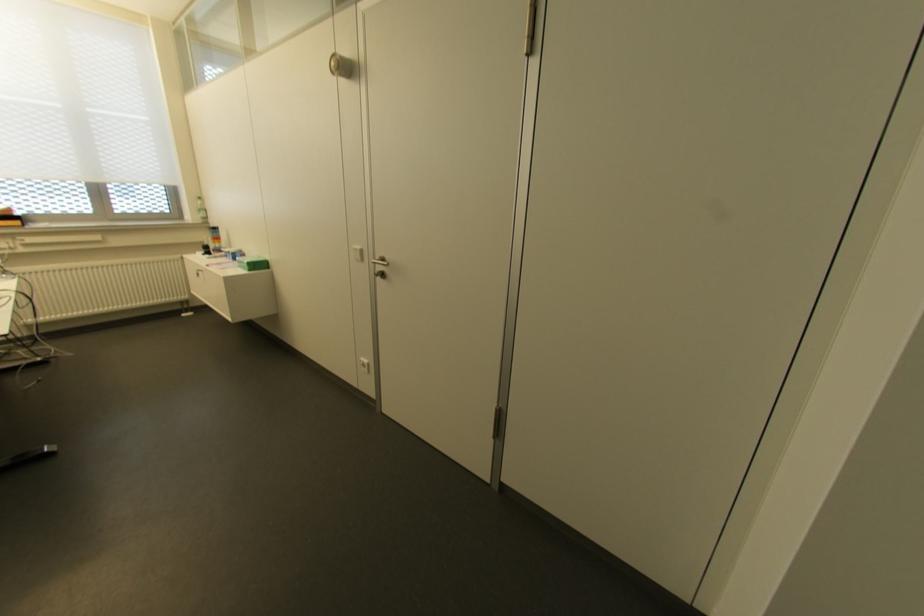
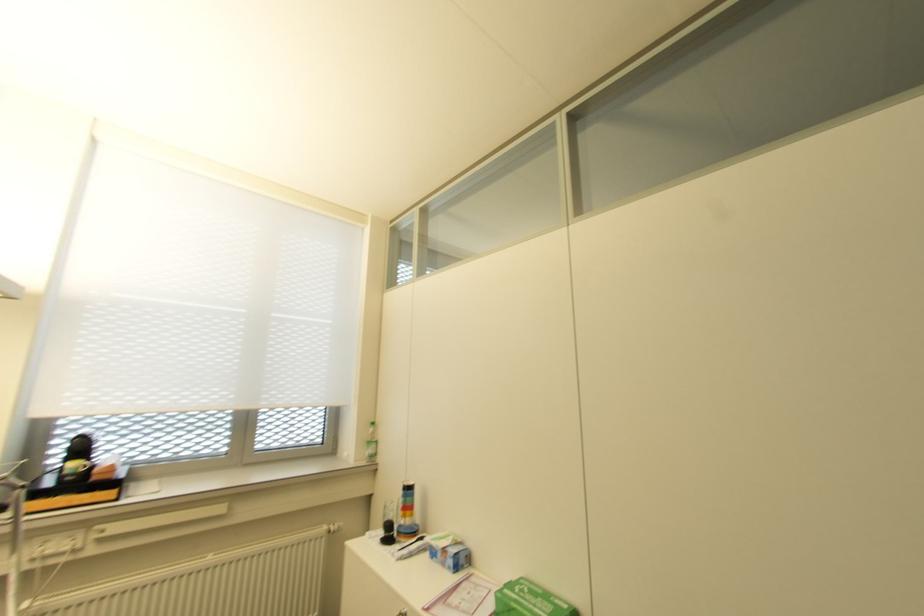
The point at (x=213, y=243) is marked in the first image. Where is the corresponding point in the second image?

(402, 517)